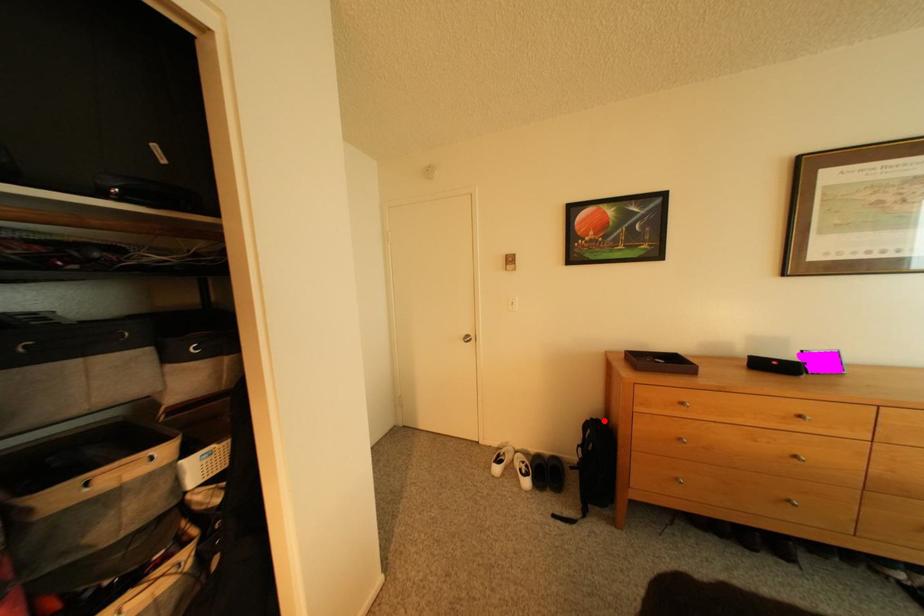
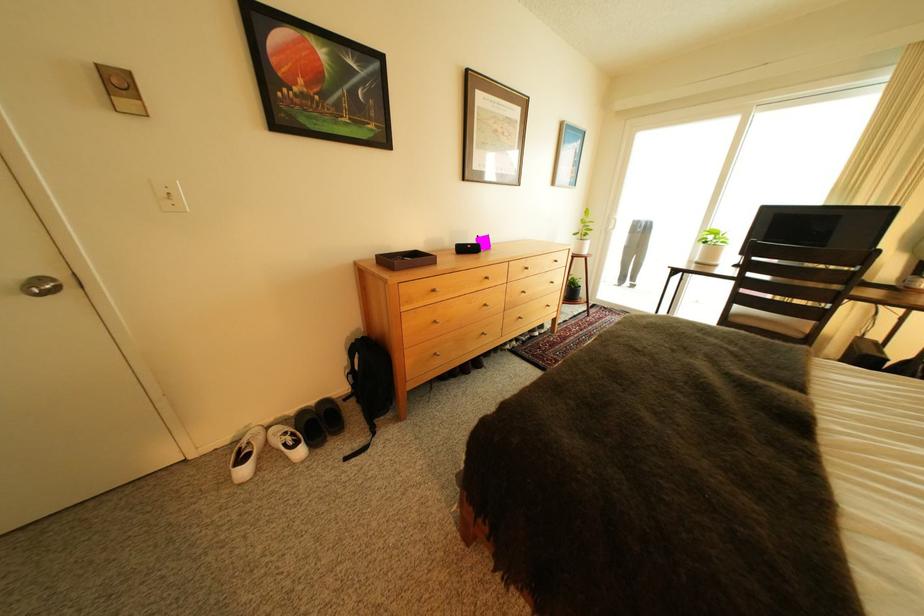
The point at the highlighted location is marked in the first image. Where is the corresponding point in the second image?

(369, 341)